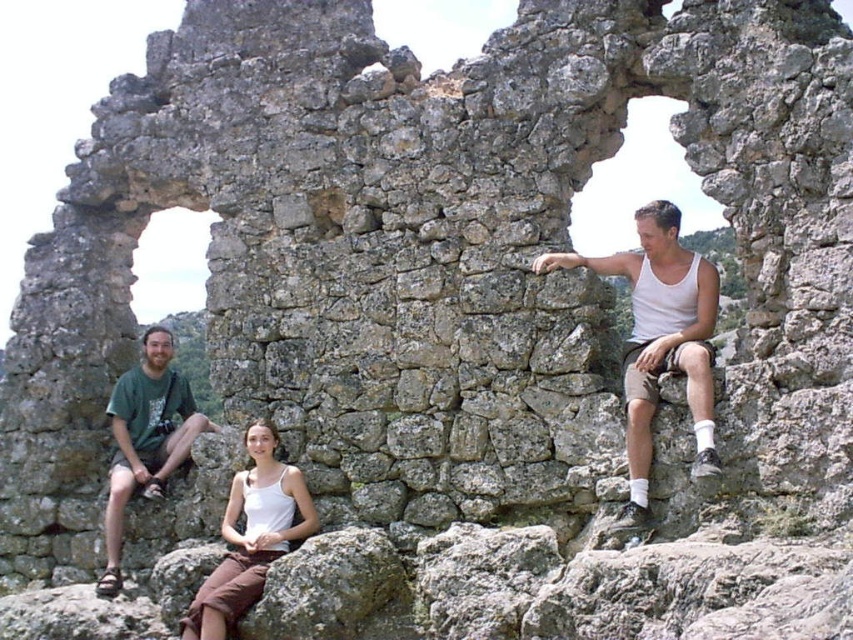
Between point (677, 221) and point (183, 397), which one is positioned behind?

The point (183, 397) is behind.

Does white matte tank top at right have a greater height compared to green t-shirt at left?

Correct, white matte tank top at right is much taller as green t-shirt at left.

Where is `white matte tank top at right`? The height and width of the screenshot is (640, 853). white matte tank top at right is located at coordinates (659, 340).

I want to click on white matte tank top at right, so click(659, 340).

Is white matte tank top at right above white cotton tank top at center?

Yes.

This screenshot has width=853, height=640. Describe the element at coordinates (659, 340) in the screenshot. I see `white matte tank top at right` at that location.

The width and height of the screenshot is (853, 640). I want to click on white matte tank top at right, so point(659,340).

In order to click on white matte tank top at right in this screenshot , I will do (x=659, y=340).

Does white cotton tank top at center come in front of green t-shirt at left?

Yes, white cotton tank top at center is closer to the viewer.

Between point (196, 605) and point (105, 572), which one is positioned in front?

Positioned in front is point (196, 605).

This screenshot has width=853, height=640. In order to click on white cotton tank top at center in this screenshot , I will do `click(251, 536)`.